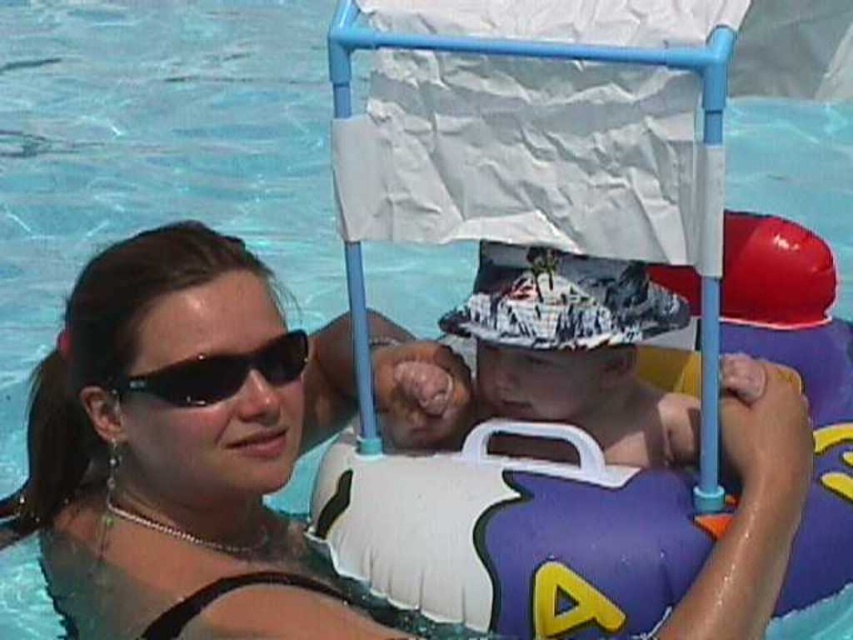
Can you confirm if sunglasses at upper left is taller than black plastic sunglasses at upper center?

Yes, sunglasses at upper left is taller than black plastic sunglasses at upper center.

Is sunglasses at upper left to the right of black plastic sunglasses at upper center from the viewer's perspective?

Incorrect, sunglasses at upper left is not on the right side of black plastic sunglasses at upper center.

Does point (234, 284) lie in front of point (297, 353)?

Yes.

Image resolution: width=853 pixels, height=640 pixels. In order to click on sunglasses at upper left in this screenshot , I will do `click(183, 449)`.

Is sunglasses at upper left smaller than white cotton hat at center?

No.

Does sunglasses at upper left have a lesser height compared to white cotton hat at center?

No.

Find the location of a particular element. The width and height of the screenshot is (853, 640). sunglasses at upper left is located at coordinates (183, 449).

Between white cotton hat at center and black plastic sunglasses at upper center, which one has more height?

With more height is white cotton hat at center.

Does white cotton hat at center appear on the left side of black plastic sunglasses at upper center?

Incorrect, white cotton hat at center is not on the left side of black plastic sunglasses at upper center.

Does point (495, 355) come farther from viewer compared to point (254, 362)?

Yes, it is behind point (254, 362).

You are a GUI agent. You are given a task and a screenshot of the screen. Output one action in this format:
    pyautogui.click(x=<x>, y=<y>)
    Task: Click on the white cotton hat at center
    The width and height of the screenshot is (853, 640).
    Given the screenshot: What is the action you would take?
    coord(575,349)